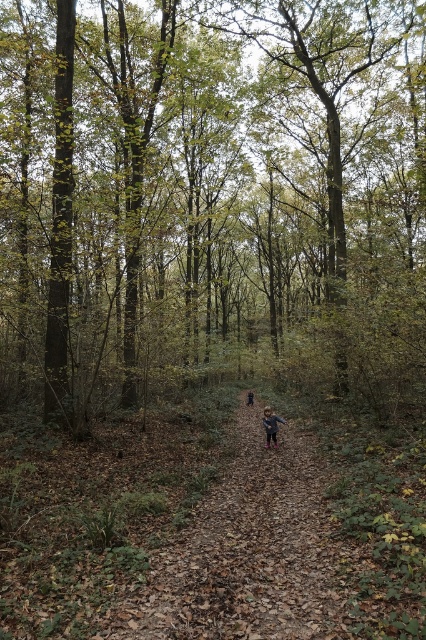
You are standing at the entrance of the forest path and see the light brown leather boots at center. Based on the coordinates given, can you tell me what object is located at point (270, 426)?

The point (270, 426) corresponds to the light brown leather boots at center.

You are standing on the forest path and want to reach a point that is closer to you. Which point should you walk towards, point (271, 428) or point (252, 396)?

You should walk towards point (271, 428) because it is closer to the viewer than point (252, 396).